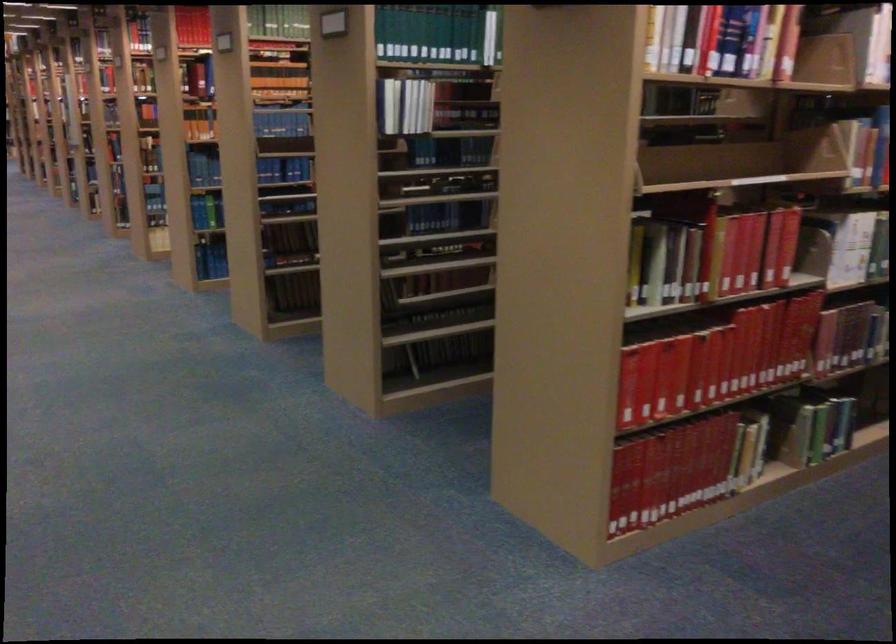
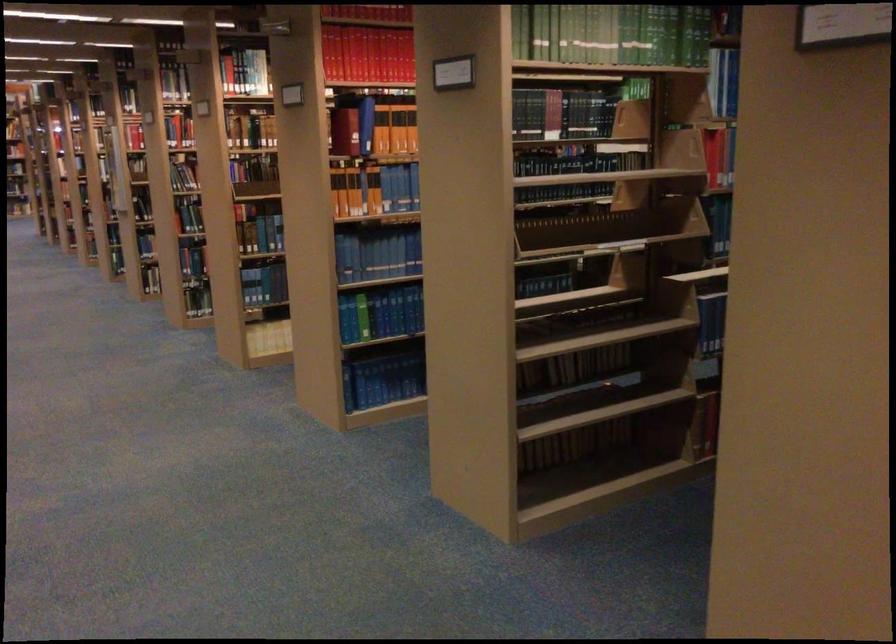
Find the pixel in the second image that matches pixel 213 182 in the first image.

(377, 254)